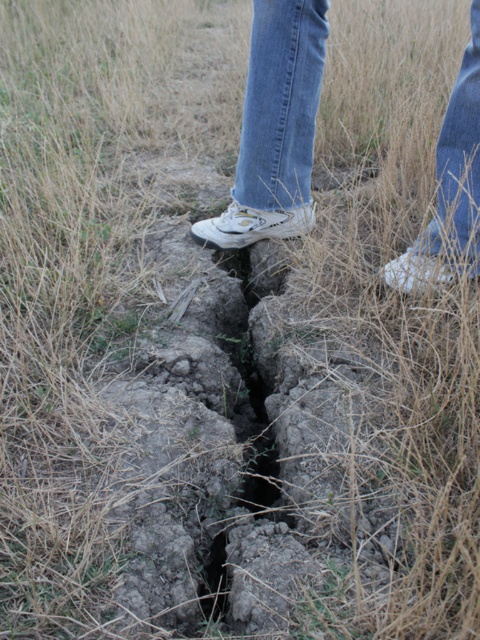
Question: Which point appears closest to the camera in this image?

Choices:
 (A) (315, 10)
 (B) (435, 252)

Answer: (B)

Question: Is white canvas sneakers at center further to camera compared to denim at right?

Choices:
 (A) no
 (B) yes

Answer: (B)

Question: Which of the following is the farthest from the observer?

Choices:
 (A) (468, 81)
 (B) (253, 134)

Answer: (B)

Question: Can you confirm if denim at center is thinner than denim at right?

Choices:
 (A) yes
 (B) no

Answer: (B)

Question: Where is white canvas sneakers at center located in relation to denim at center in the image?

Choices:
 (A) above
 (B) below

Answer: (B)

Question: Estimate the real-world distances between objects in this image. Which object is farther from the white canvas sneakers at center?

Choices:
 (A) denim at center
 (B) denim at right

Answer: (B)